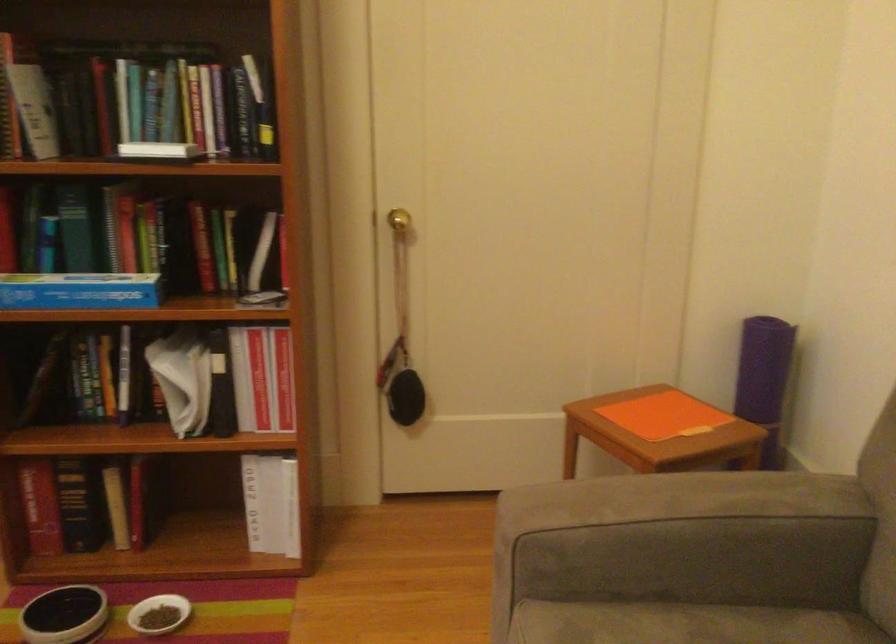
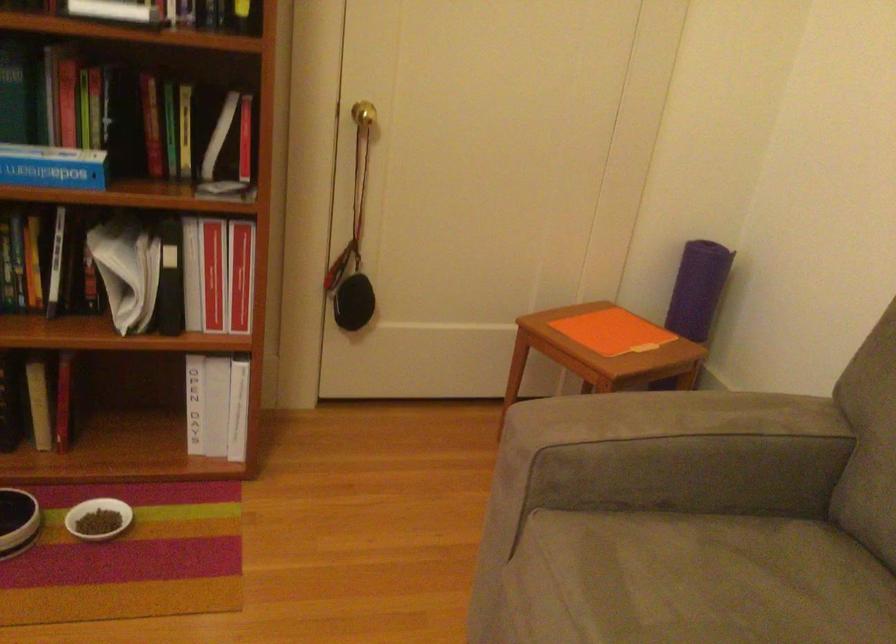
Question: Based on the continuous images, in which direction is the camera rotating? Reply with the corresponding letter.

Choices:
 (A) Left
 (B) Right
 (C) Up
 (D) Down

Answer: (B)